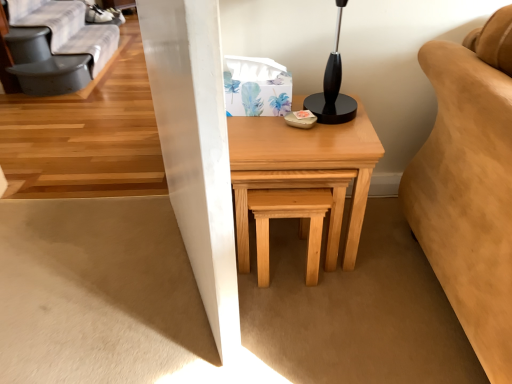
Question: Is gray fabric futon at upper left wider than natural wood table at center?

Choices:
 (A) no
 (B) yes

Answer: (A)

Question: Is gray fabric futon at upper left thinner than natural wood table at center?

Choices:
 (A) yes
 (B) no

Answer: (A)

Question: Is gray fabric futon at upper left with natural wood table at center?

Choices:
 (A) yes
 (B) no

Answer: (B)

Question: From the image's perspective, would you say gray fabric futon at upper left is positioned over natural wood table at center?

Choices:
 (A) yes
 (B) no

Answer: (A)

Question: Can natural wood table at center be found inside gray fabric futon at upper left?

Choices:
 (A) no
 (B) yes

Answer: (A)

Question: Can you confirm if gray fabric futon at upper left is smaller than natural wood table at center?

Choices:
 (A) yes
 (B) no

Answer: (A)

Question: Is gray fabric futon at upper left not within natural wood stool at center?

Choices:
 (A) no
 (B) yes

Answer: (B)

Question: Is natural wood stool at center at the back of gray fabric futon at upper left?

Choices:
 (A) yes
 (B) no

Answer: (B)

Question: Does gray fabric futon at upper left appear on the left side of natural wood stool at center?

Choices:
 (A) yes
 (B) no

Answer: (A)

Question: Does gray fabric futon at upper left contain natural wood stool at center?

Choices:
 (A) yes
 (B) no

Answer: (B)

Question: Is gray fabric futon at upper left smaller than natural wood stool at center?

Choices:
 (A) no
 (B) yes

Answer: (A)

Question: Can you confirm if gray fabric futon at upper left is bigger than natural wood stool at center?

Choices:
 (A) yes
 (B) no

Answer: (A)

Question: Is natural wood table at center aimed at natural wood stool at center?

Choices:
 (A) yes
 (B) no

Answer: (A)